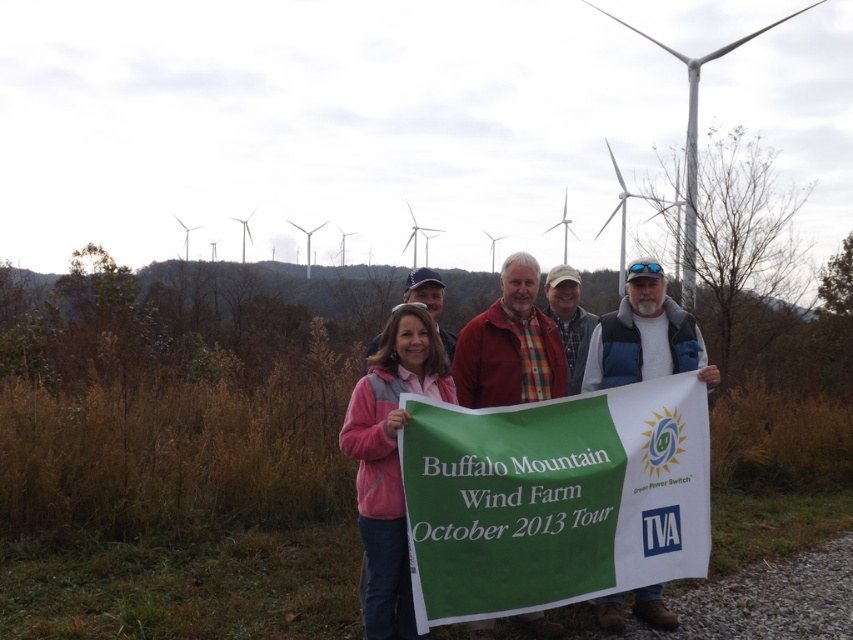
You are a photographer trying to capture a group photo of the matte pink jacket at center and the red plaid shirt at center. If you want to ensure both are fully visible in the frame, which person should you position closer to the camera?

You should position the matte pink jacket at center closer to the camera because it might be wider than the red plaid shirt at center, ensuring both fit within the frame.

You are a photographer standing 3 meters away from the group. You want to take a photo of the pink fleece jacket at center while keeping the camera in your hand. Can you reach the jacket without moving closer?

The pink fleece jacket at center and camera are 4.00 meters apart from each other. Since you are already 3 meters away from the group, the total distance between you and the jacket is 3 meters plus the 4 meters between the jacket and the camera, totaling 7 meters. Therefore, you cannot reach the jacket without moving closer.

You are standing in front of the Buffalo Mountain Wind Farm and see two points marked in the image. Which point is closer to you, point (405, 365) or point (407, 612)?

Point (405, 365) is closer to the viewer than point (407, 612).